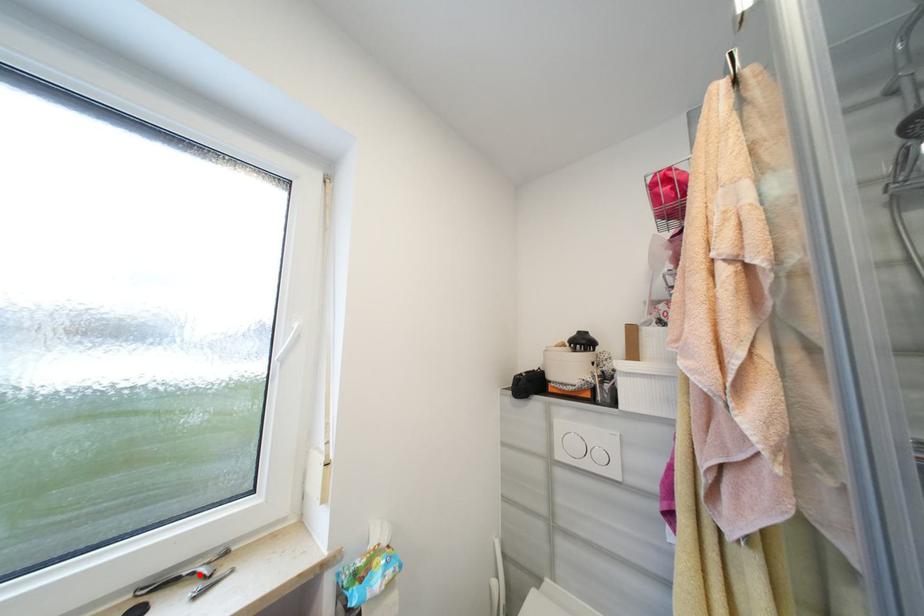
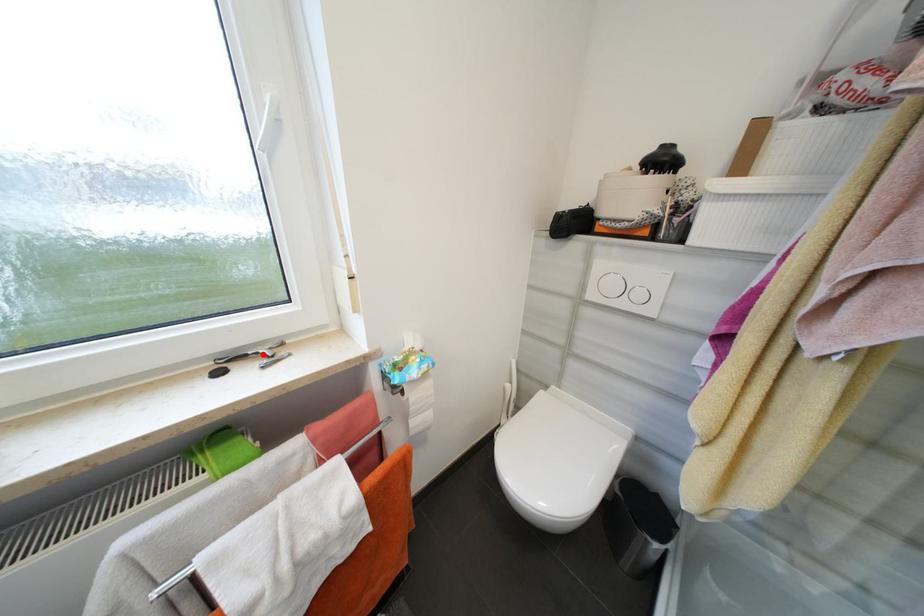
I am providing you with two images of the same scene from different viewpoints. A red point is marked on the first image and another point is marked on the second image. Does the point marked in image1 correspond to the same location as the one in image2?

Yes